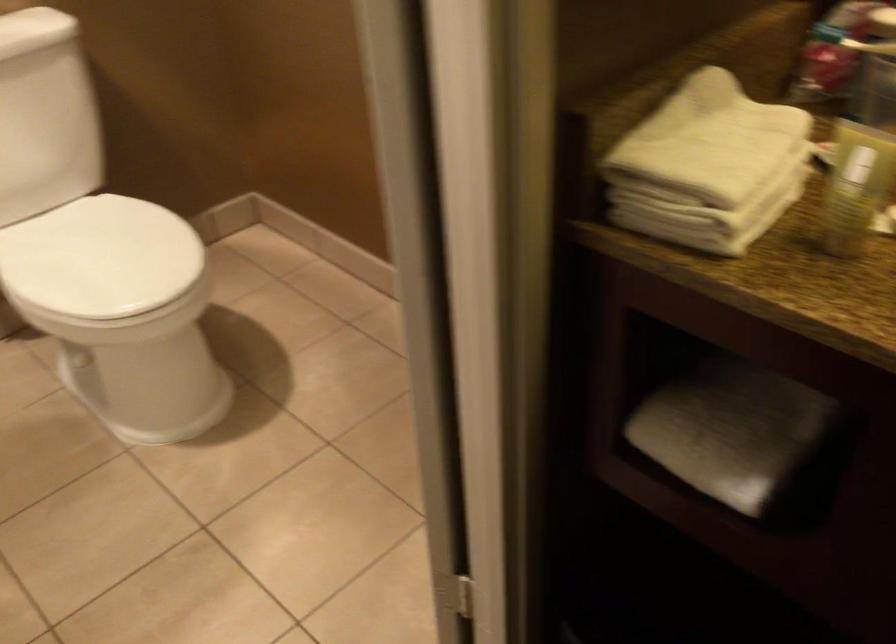
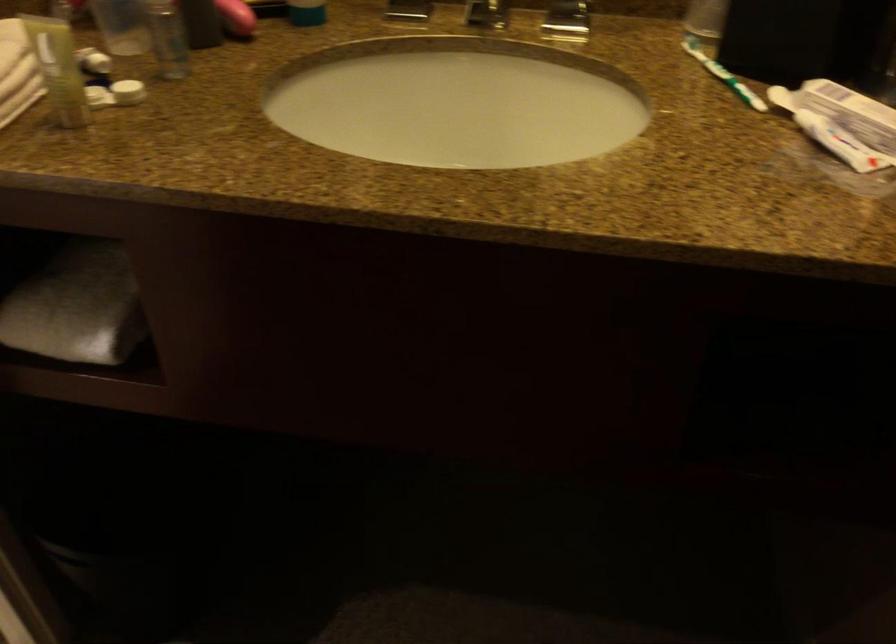
Locate, in the second image, the point that corresponds to (730,436) in the first image.

(76, 306)